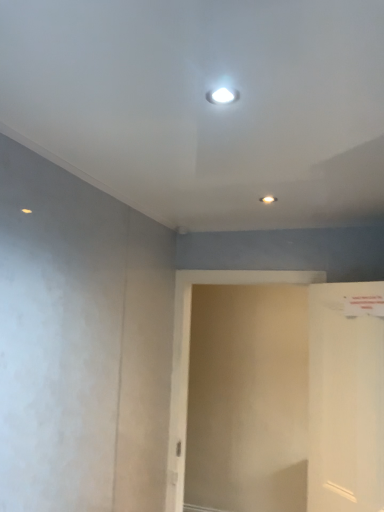
This screenshot has width=384, height=512. What do you see at coordinates (346, 397) in the screenshot? I see `white glossy door at right` at bounding box center [346, 397].

I want to click on white glossy door at right, so click(x=346, y=397).

Describe the element at coordinates (189, 356) in the screenshot. I see `beige matte screen door at center` at that location.

The height and width of the screenshot is (512, 384). I want to click on beige matte screen door at center, so click(x=189, y=356).

What is the approximate height of beige matte screen door at center?

The height of beige matte screen door at center is 4.76 feet.

You are a GUI agent. You are given a task and a screenshot of the screen. Output one action in this format:
    pyautogui.click(x=<x>, y=<y>)
    Task: Click on the white glossy door at right
    The image size is (384, 512).
    Given the screenshot: What is the action you would take?
    click(346, 397)

Looking at this image, does white glossy door at right appear on the left side of beige matte screen door at center?

Incorrect, white glossy door at right is not on the left side of beige matte screen door at center.

Which is behind, white glossy door at right or beige matte screen door at center?

beige matte screen door at center is more distant.

Does point (334, 413) come behind point (179, 364)?

No, (334, 413) is in front of (179, 364).

From the image's perspective, is white glossy door at right below beige matte screen door at center?

No, from the image's perspective, white glossy door at right is not below beige matte screen door at center.

From a real-world perspective, is white glossy door at right below beige matte screen door at center?

No, from a real-world perspective, white glossy door at right is not under beige matte screen door at center.

Can you confirm if white glossy door at right is wider than beige matte screen door at center?

Correct, the width of white glossy door at right exceeds that of beige matte screen door at center.

Who is taller, white glossy door at right or beige matte screen door at center?

Standing taller between the two is beige matte screen door at center.

Which of these two, white glossy door at right or beige matte screen door at center, is bigger?

beige matte screen door at center is bigger.

Is beige matte screen door at center surrounded by white glossy door at right?

No, beige matte screen door at center is not inside white glossy door at right.

Is white glossy door at right not close to beige matte screen door at center?

That's not correct — white glossy door at right is a little close to beige matte screen door at center.

Is white glossy door at right aimed at beige matte screen door at center?

No, white glossy door at right is not oriented towards beige matte screen door at center.

How far apart are white glossy door at right and beige matte screen door at center?

white glossy door at right and beige matte screen door at center are 25.76 inches apart from each other.

Where is `door lying on the right of beige matte screen door at center`? Image resolution: width=384 pixels, height=512 pixels. door lying on the right of beige matte screen door at center is located at coordinates (346, 397).

Which object is positioned more to the right, beige matte screen door at center or white glossy door at right?

Positioned to the right is white glossy door at right.

Considering the relative positions of beige matte screen door at center and white glossy door at right in the image provided, is beige matte screen door at center in front of white glossy door at right?

That is False.

Does point (175, 379) appear closer or farther from the camera than point (365, 378)?

Point (175, 379) appears to be farther away from the viewer than point (365, 378).

From the image's perspective, which is above, beige matte screen door at center or white glossy door at right?

From the image's view, white glossy door at right is above.

From a real-world perspective, which object rests below the other?

beige matte screen door at center is physically lower.

Which of these two, beige matte screen door at center or white glossy door at right, is thinner?

beige matte screen door at center.

Considering the sizes of beige matte screen door at center and white glossy door at right in the image, is beige matte screen door at center taller or shorter than white glossy door at right?

Clearly, beige matte screen door at center is taller compared to white glossy door at right.

Between beige matte screen door at center and white glossy door at right, which one has larger size?

beige matte screen door at center.

Could white glossy door at right be considered to be inside beige matte screen door at center?

No.

Would you consider beige matte screen door at center to be distant from white glossy door at right?

No, beige matte screen door at center is not far from white glossy door at right.

Is beige matte screen door at center turned away from white glossy door at right?

No, beige matte screen door at center is not facing the opposite direction of white glossy door at right.

How far apart are beige matte screen door at center and white glossy door at right?

beige matte screen door at center and white glossy door at right are 25.76 inches apart from each other.

I want to click on door above the beige matte screen door at center (from a real-world perspective), so click(x=346, y=397).

Locate an element on the screen. The width and height of the screenshot is (384, 512). screen door below the white glossy door at right (from the image's perspective) is located at coordinates (189, 356).

Image resolution: width=384 pixels, height=512 pixels. Find the location of `door in front of the beige matte screen door at center`. door in front of the beige matte screen door at center is located at coordinates (346, 397).